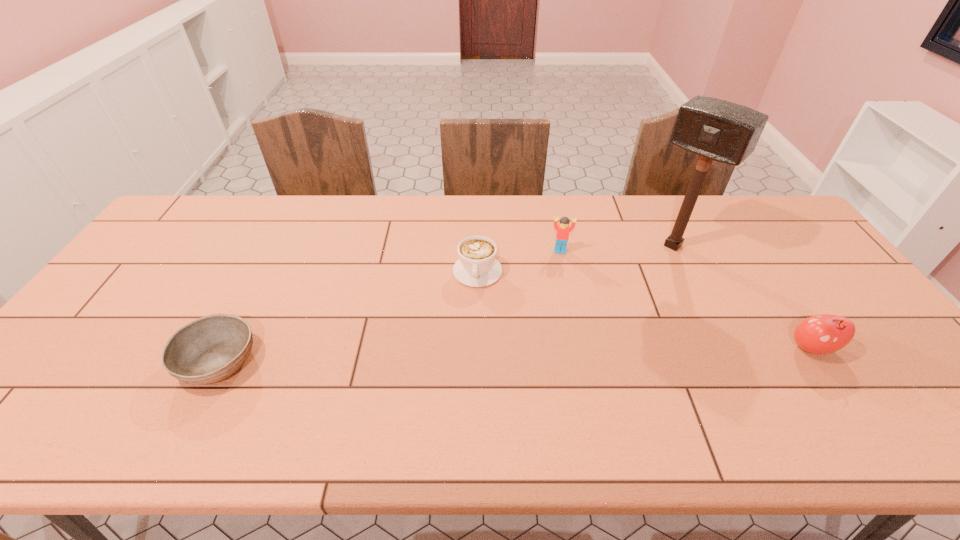
The image size is (960, 540). I want to click on bowl, so click(x=209, y=349).

Where is `the leftmost object`? The image size is (960, 540). the leftmost object is located at coordinates (209, 349).

Find the location of `the rightmost object`. the rightmost object is located at coordinates (821, 334).

This screenshot has width=960, height=540. In order to click on Lego in this screenshot , I will do `click(563, 229)`.

Find the location of `the second object from right to left`. the second object from right to left is located at coordinates (715, 129).

Image resolution: width=960 pixels, height=540 pixels. I want to click on the tallest object, so click(715, 129).

This screenshot has height=540, width=960. I want to click on cappuccino, so click(477, 267).

Where is `the second object from left to right`? The height and width of the screenshot is (540, 960). the second object from left to right is located at coordinates (477, 267).

You are a GUI agent. You are given a task and a screenshot of the screen. Output one action in this format:
    pyautogui.click(x=<x>, y=<y>)
    Task: Click on the vacant space positioned on the back of the leftmost object
    The height and width of the screenshot is (540, 960).
    Given the screenshot: What is the action you would take?
    pyautogui.click(x=283, y=237)

Where is `vacant space located on the stem of the rightmost object`? The width and height of the screenshot is (960, 540). vacant space located on the stem of the rightmost object is located at coordinates (839, 389).